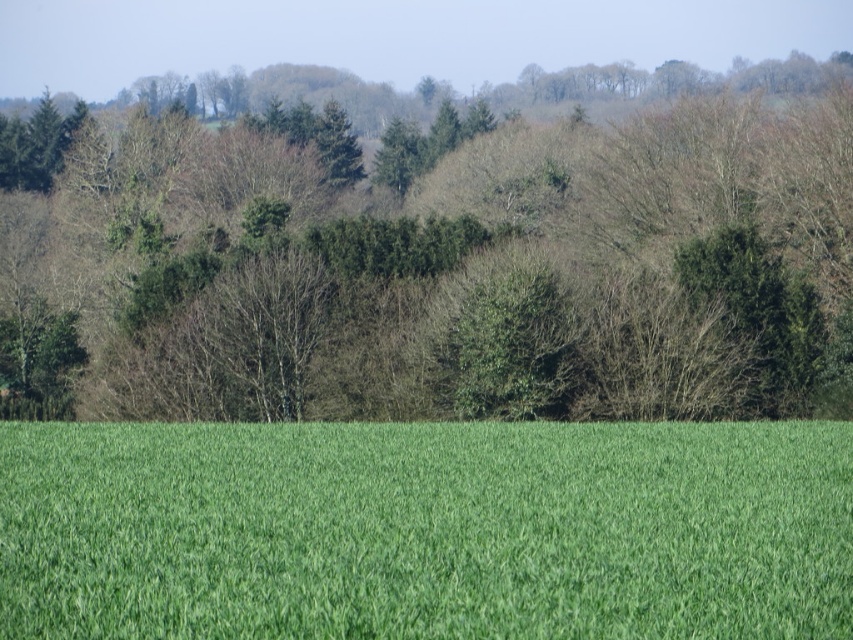
Question: Is green leafy trees at center closer to the viewer compared to green grass at center?

Choices:
 (A) yes
 (B) no

Answer: (B)

Question: Does green leafy trees at center have a greater width compared to green grass at center?

Choices:
 (A) no
 (B) yes

Answer: (B)

Question: Is green leafy trees at center above green grass at center?

Choices:
 (A) yes
 (B) no

Answer: (A)